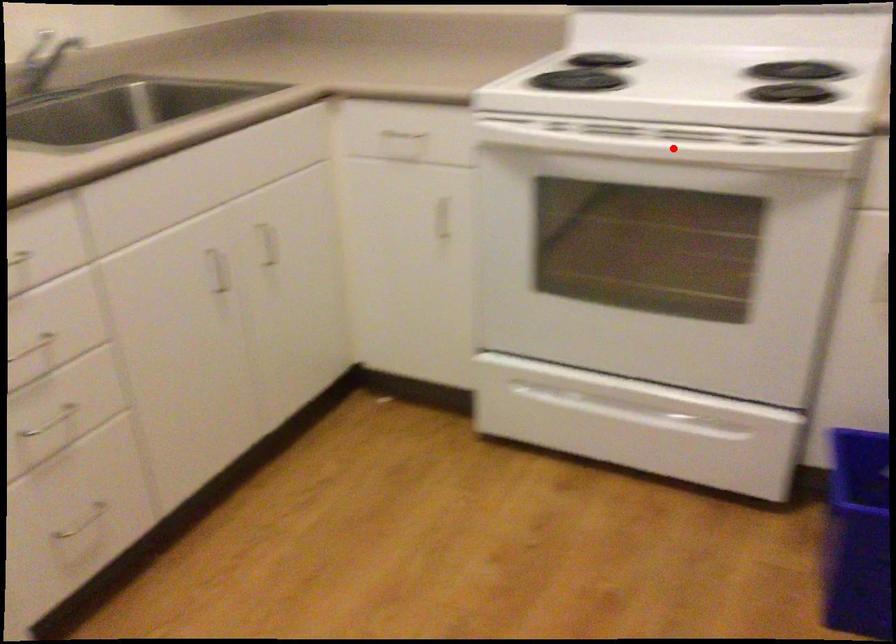
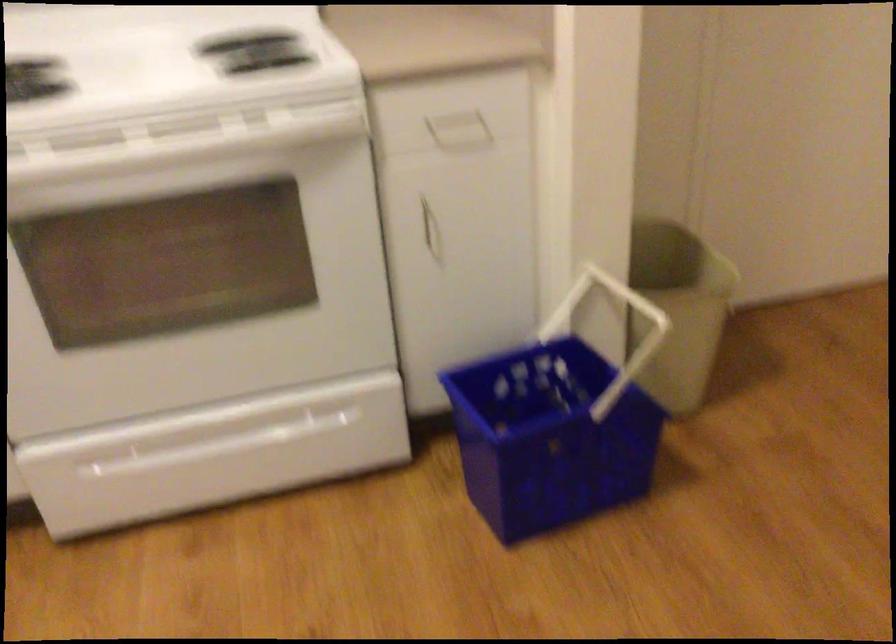
Question: I am providing you with two images of the same scene from different viewpoints. A red point is shown in image1. For the corresponding object point in image2, is it positioned nearer or farther from the camera?

Choices:
 (A) Nearer
 (B) Farther

Answer: (A)